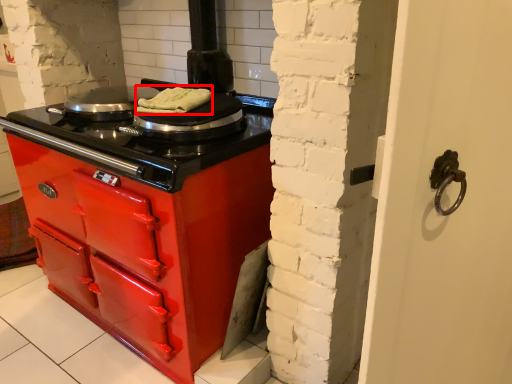
Question: Considering the relative positions of food (annotated by the red box) and kitchen appliance in the image provided, where is food (annotated by the red box) located with respect to the staircase?

Choices:
 (A) left
 (B) right

Answer: (B)